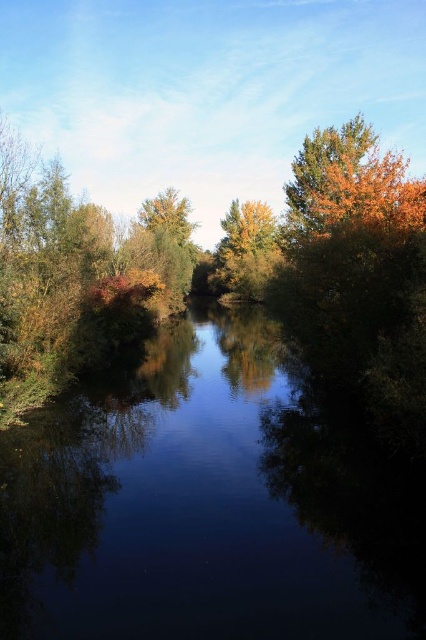
Question: Which of the following is the farthest from the observer?

Choices:
 (A) dark reflective water at center
 (B) green matte tree at center

Answer: (B)

Question: Is dark reflective water at center positioned in front of green matte tree at center?

Choices:
 (A) no
 (B) yes

Answer: (B)

Question: Which of the following is the farthest from the observer?

Choices:
 (A) green matte tree at center
 (B) dark reflective water at center

Answer: (A)

Question: Is dark reflective water at center in front of green matte tree at center?

Choices:
 (A) no
 (B) yes

Answer: (B)

Question: Is dark reflective water at center smaller than green matte tree at center?

Choices:
 (A) yes
 (B) no

Answer: (A)